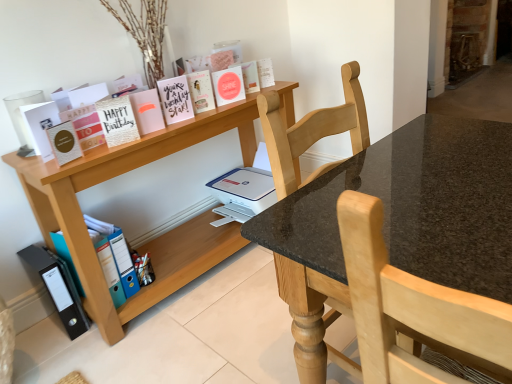
Find the location of a particular element. The height and width of the screenshot is (384, 512). free space in front of matte pink card at upper center, the sixth paperback book when ordered from left to right is located at coordinates (169, 130).